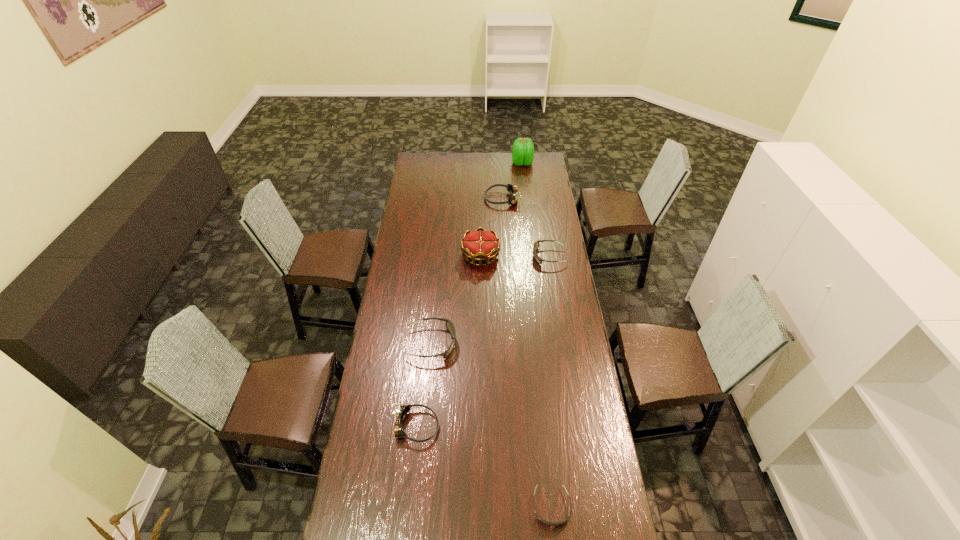
In the image, there is a desktop. Where is `vacant space at the far left corner`? The height and width of the screenshot is (540, 960). vacant space at the far left corner is located at coordinates (424, 160).

Find the location of a particular element. This screenshot has height=540, width=960. vacant area that lies between the bell pepper and the shortest object is located at coordinates (537, 335).

Locate an element on the screen. vacant area that lies between the third nearest goggles and the left bronze goggles is located at coordinates (424, 385).

Locate an element on the screen. This screenshot has height=540, width=960. empty space that is in between the nearer bronze goggles and the sixth shortest object is located at coordinates (448, 341).

Identify the location of vacant region between the gold crown and the nearest goggles. (516, 381).

The height and width of the screenshot is (540, 960). I want to click on empty space between the shortest goggles and the crown, so click(516, 381).

Find the location of `free spot between the tallest object and the right bronze goggles`. free spot between the tallest object and the right bronze goggles is located at coordinates 513,181.

At what (x,y) coordinates should I click in order to perform the action: click on vacant area between the sixth shortest object and the nearer bronze goggles. Please return your answer as a coordinate pair (x, y). The height and width of the screenshot is (540, 960). Looking at the image, I should click on (448, 341).

Locate an element on the screen. The image size is (960, 540). free spot between the biggest black goggles and the right bronze goggles is located at coordinates (467, 271).

Where is `free space that is in between the second nearest black goggles and the second farthest object`? free space that is in between the second nearest black goggles and the second farthest object is located at coordinates (467, 271).